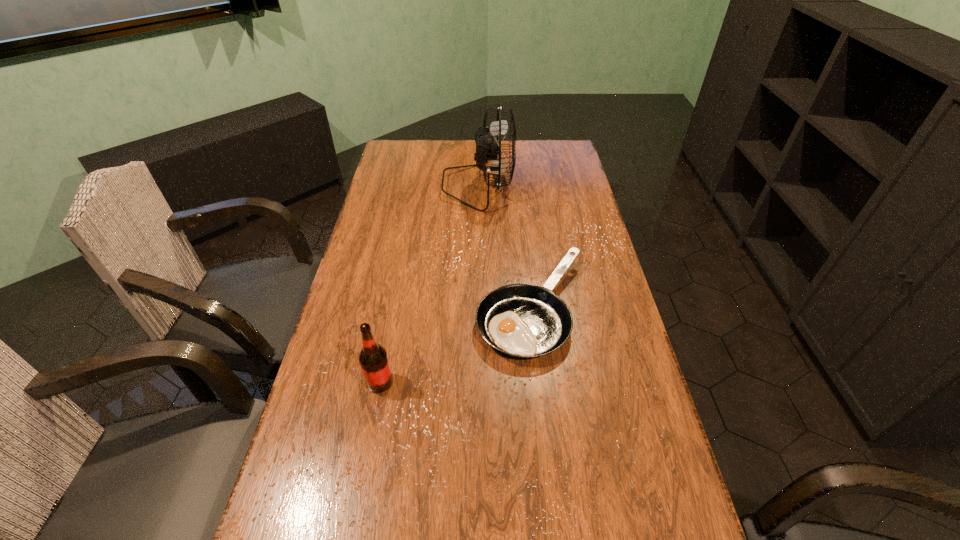
Find the location of `object that is positioned at the left edge`. object that is positioned at the left edge is located at coordinates (373, 358).

This screenshot has width=960, height=540. I want to click on object positioned at the right edge, so click(523, 320).

Locate an element on the screen. vacant space at the far edge of the desktop is located at coordinates (521, 141).

This screenshot has height=540, width=960. Identify the location of free region at the left edge of the desktop. (389, 271).

This screenshot has width=960, height=540. In the image, there is a desktop. Find the location of `free space at the right edge`. free space at the right edge is located at coordinates (632, 395).

In the image, there is a desktop. At what (x,y) coordinates should I click in order to perform the action: click on vacant space at the far left corner. Please return your answer as a coordinate pair (x, y). Looking at the image, I should click on (406, 167).

This screenshot has height=540, width=960. Find the location of `vacant space at the far right corner`. vacant space at the far right corner is located at coordinates (577, 166).

The width and height of the screenshot is (960, 540). Find the location of `free space between the nearest object and the farthest object`. free space between the nearest object and the farthest object is located at coordinates (429, 284).

Locate an element on the screen. This screenshot has width=960, height=540. free area in between the tallest object and the leftmost object is located at coordinates (429, 284).

This screenshot has width=960, height=540. Find the location of `free point between the second shortest object and the fan`. free point between the second shortest object and the fan is located at coordinates (429, 284).